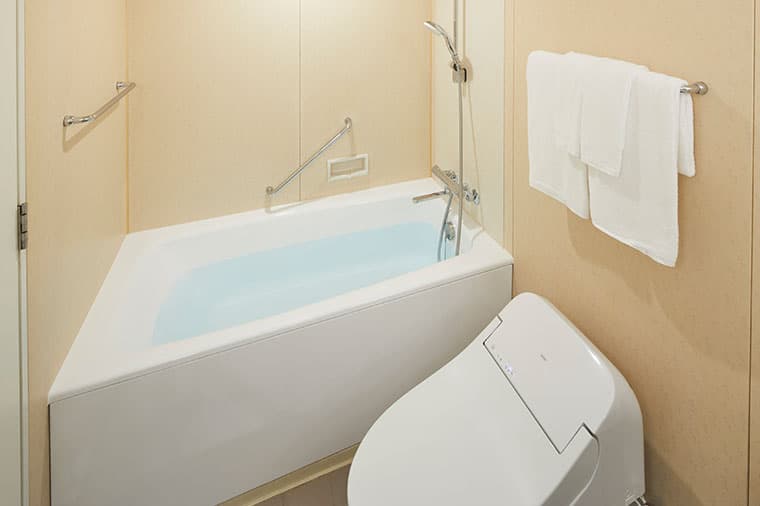
Locate an element on the screen. Image resolution: width=760 pixels, height=506 pixels. towel is located at coordinates point(553,133).